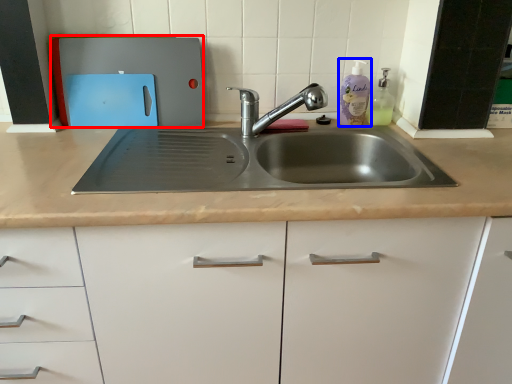
Question: Which object is closer to the camera taking this photo, appliance (highlighted by a red box) or cleaning product (highlighted by a blue box)?

Choices:
 (A) appliance
 (B) cleaning product

Answer: (A)